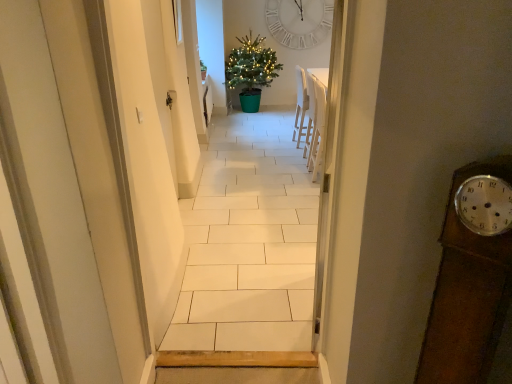
Question: Does point (246, 109) appear closer or farther from the camera than point (205, 74)?

Choices:
 (A) closer
 (B) farther

Answer: (B)

Question: Is green plastic christmas tree at center wider or thinner than green glossy plant at center?

Choices:
 (A) thin
 (B) wide

Answer: (B)

Question: Which object is positioned farthest from the green glossy plant at center?

Choices:
 (A) green plastic christmas tree at center
 (B) white wooden clock at upper center
 (C) white plastic chair at upper right
 (D) white tile floor at center

Answer: (D)

Question: Considering the real-world distances, which object is closest to the white wooden clock at upper center?

Choices:
 (A) white plastic chair at upper right
 (B) white tile floor at center
 (C) green plastic christmas tree at center
 (D) green glossy plant at center

Answer: (C)